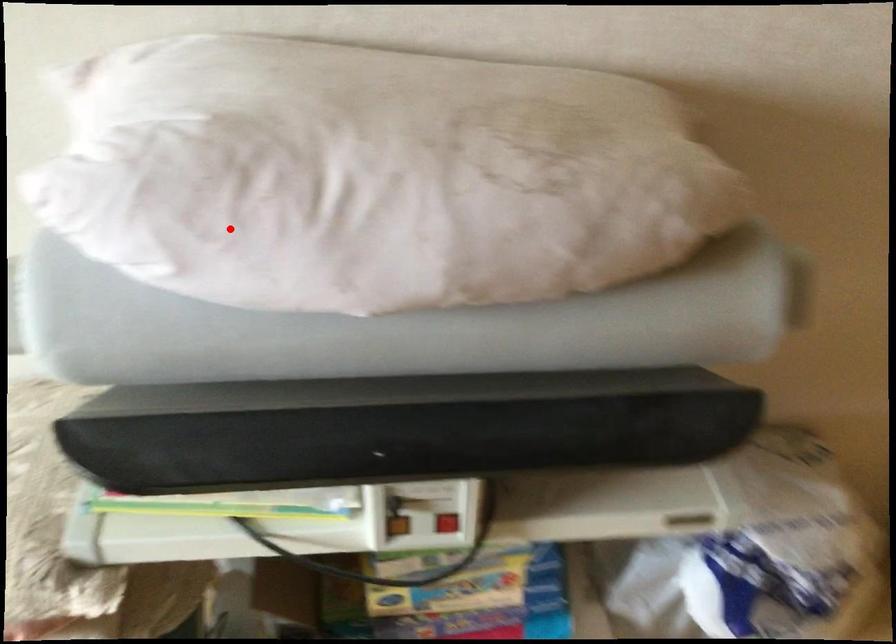
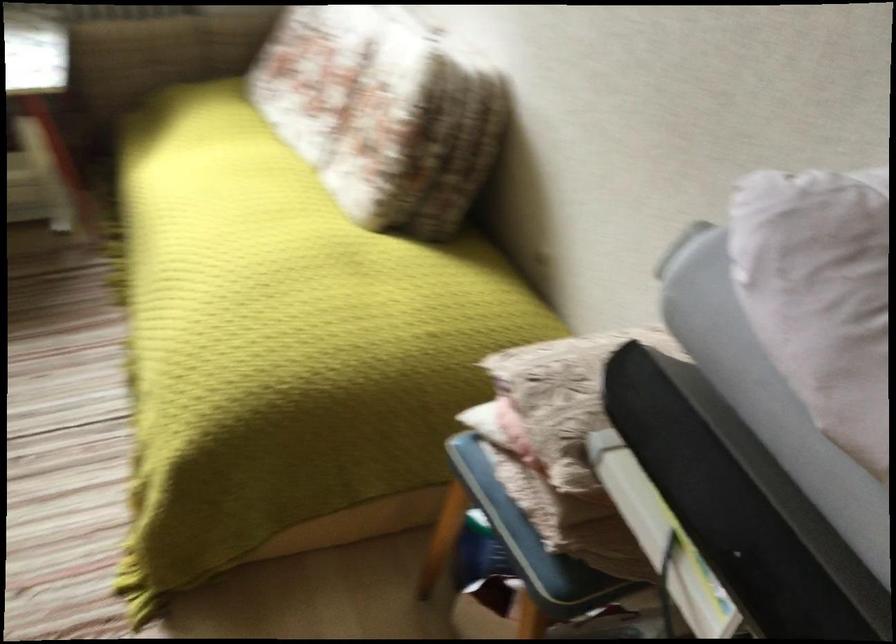
Locate, in the second image, the point that corresponds to the highlighted location in the first image.

(821, 295)